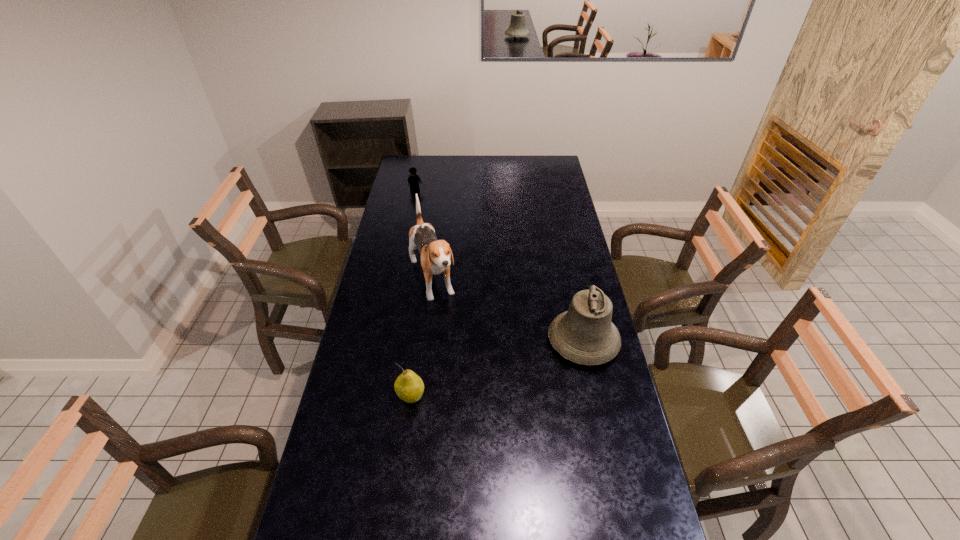
At what (x,y) coordinates should I click in order to perform the action: click on free space on the desktop that is between the nearest object and the third farthest object and is positioned at the face of the puppy. Please return your answer as a coordinate pair (x, y). Image resolution: width=960 pixels, height=540 pixels. Looking at the image, I should click on (476, 376).

At what (x,y) coordinates should I click in order to perform the action: click on free space on the desktop that is between the nearest object and the rightmost object and is positioned on the front-facing side of the Lego. Please return your answer as a coordinate pair (x, y). Image resolution: width=960 pixels, height=540 pixels. Looking at the image, I should click on (515, 363).